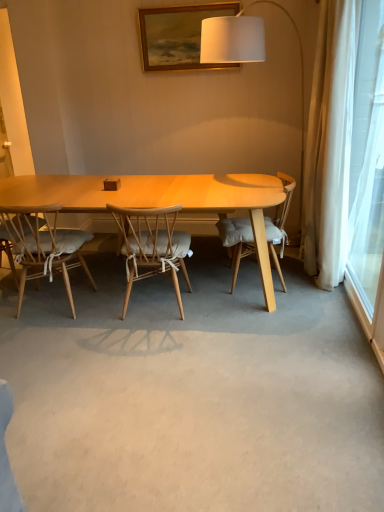
At what (x,y) coordinates should I click in order to perform the action: click on vacant space underneath natural wood chair with cushion at center, which is the 2th chair from right to left (from a real-world perspective). Please return your answer as a coordinate pair (x, y). Image resolution: width=384 pixels, height=512 pixels. Looking at the image, I should click on (155, 306).